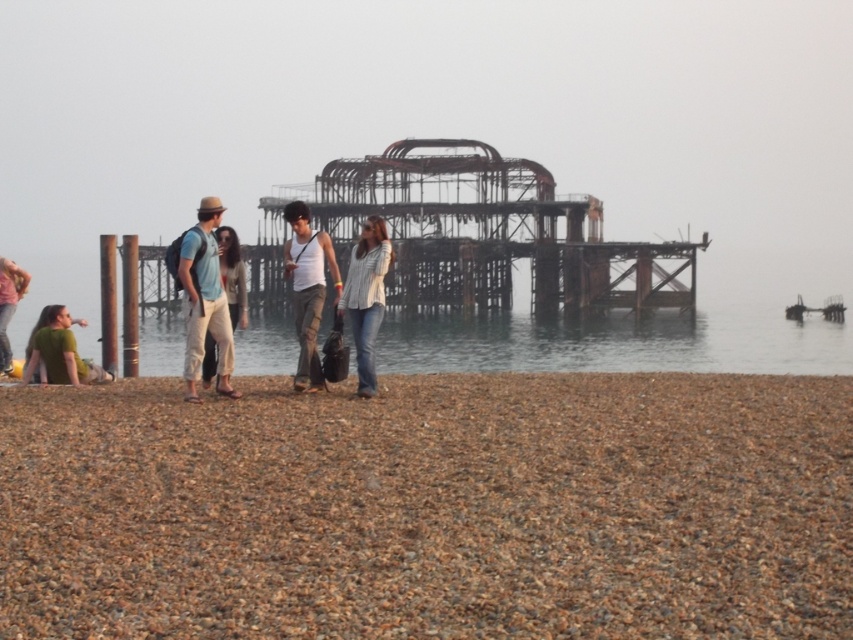
Question: Which point is closer to the camera?

Choices:
 (A) matte white tank top at center
 (B) matte blue shirt at center
 (C) white cotton shirt at center

Answer: (B)

Question: Can you confirm if white cotton shirt at center is wider than smooth wooden pole at left?

Choices:
 (A) no
 (B) yes

Answer: (A)

Question: Which object is positioned farthest from the matte blue shirt at center?

Choices:
 (A) light brown cotton pants at center
 (B) white cotton shirt at center
 (C) brown gravel at lower center
 (D) clear water at center

Answer: (D)

Question: Can you confirm if brown gravel at lower center is thinner than green matte shirt at lower left?

Choices:
 (A) no
 (B) yes

Answer: (A)

Question: Which of the following is the farthest from the observer?

Choices:
 (A) (827, 369)
 (B) (7, 285)
 (C) (219, 256)
 (D) (100, 426)

Answer: (A)

Question: Observing the image, what is the correct spatial positioning of matte blue shirt at center in reference to smooth brown pole at center?

Choices:
 (A) above
 (B) below

Answer: (B)